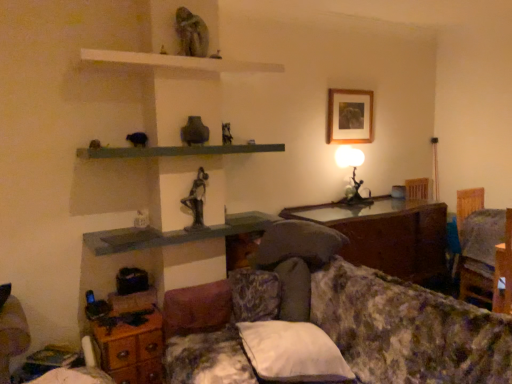
Question: Based on their sizes in the image, would you say green matte shelf at center, acting as the second shelf starting from the bottom, is bigger or smaller than wooden dresser at lower left?

Choices:
 (A) small
 (B) big

Answer: (A)

Question: Is point click(x=142, y=155) positioned closer to the camera than point click(x=143, y=319)?

Choices:
 (A) closer
 (B) farther

Answer: (A)

Question: Which object is positioned farthest from the wooden glossy table at center?

Choices:
 (A) floral fabric couch at lower right
 (B) bronze statue at center
 (C) white soft pillow at lower center
 (D) green matte shelf at center, placed as the second shelf when sorted from top to bottom
 (E) metallic silver table lamp at upper right

Answer: (B)

Question: Which of these objects is positioned closest to the matte gray shelf at center, positioned as the 1th shelf in bottom-to-top order?

Choices:
 (A) white soft pillow at lower center
 (B) wooden dresser at lower left
 (C) floral fabric couch at lower right
 (D) metallic silver table lamp at upper right
 (E) white matte shelf at upper center, acting as the third shelf starting from the bottom

Answer: (B)